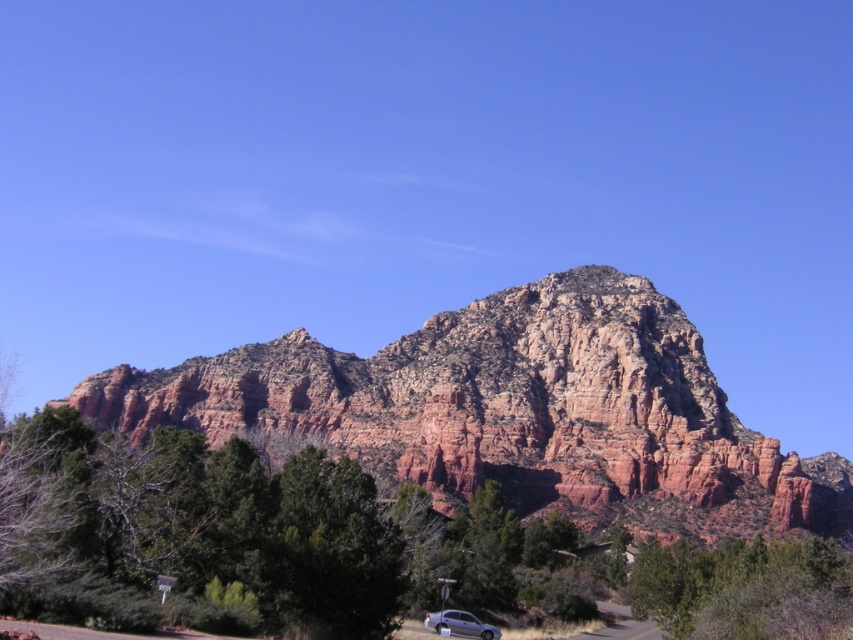
Question: Considering the real-world distances, which object is farthest from the silver metallic car at lower center?

Choices:
 (A) rustic rock formation at center
 (B) green leafy tree at lower right

Answer: (A)

Question: Which object is positioned farthest from the silver metallic car at lower center?

Choices:
 (A) green leafy tree at lower right
 (B) rustic rock formation at center

Answer: (B)

Question: Observing the image, what is the correct spatial positioning of rustic rock formation at center in reference to silver metallic car at lower center?

Choices:
 (A) left
 (B) right

Answer: (B)

Question: Can you confirm if rustic rock formation at center is thinner than green leafy tree at lower right?

Choices:
 (A) yes
 (B) no

Answer: (B)

Question: From the image, what is the correct spatial relationship of green leafy tree at lower right in relation to silver metallic car at lower center?

Choices:
 (A) below
 (B) above

Answer: (B)

Question: Which point is closer to the camera taking this photo?

Choices:
 (A) (764, 596)
 (B) (463, 628)

Answer: (A)